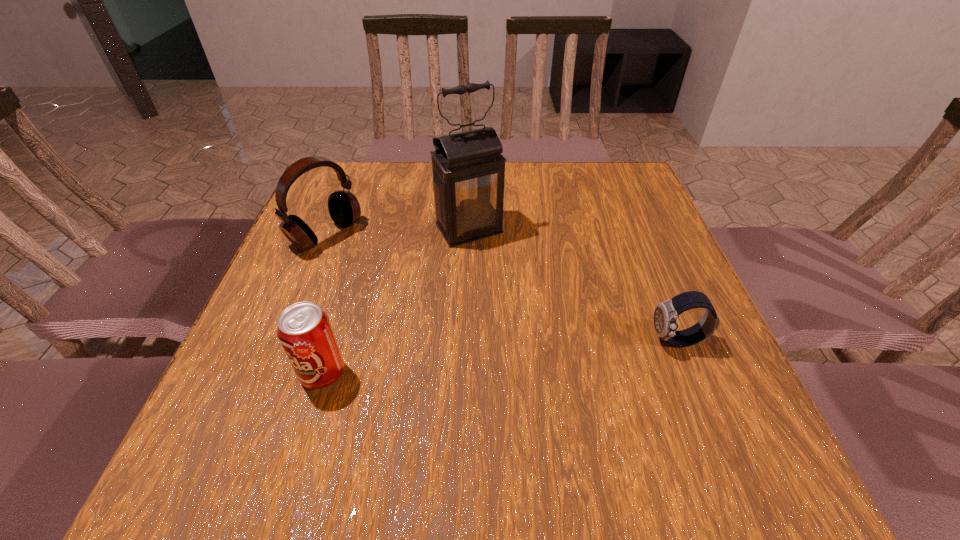
What are the coordinates of `object located in the near left corner section of the desktop` in the screenshot? It's located at click(304, 330).

Image resolution: width=960 pixels, height=540 pixels. What are the coordinates of `vacant region at the far edge of the desktop` in the screenshot? It's located at (552, 208).

Identify the location of free location at the near edge. coord(464,422).

In the image, there is a desktop. In order to click on vacant region at the left edge in this screenshot , I will do `click(312, 225)`.

Locate an element on the screen. free space at the far right corner is located at coordinates (588, 182).

I want to click on empty space between the tallest object and the third shortest object, so click(397, 232).

Where is `free spot between the watch and the headset`? The width and height of the screenshot is (960, 540). free spot between the watch and the headset is located at coordinates (501, 288).

Identify the location of free space that is in between the lantern and the watch. (573, 285).

Locate an element on the screen. free space between the tallest object and the headset is located at coordinates (397, 232).

The width and height of the screenshot is (960, 540). Find the location of `vacant area that lies between the tallest object and the third tallest object`. vacant area that lies between the tallest object and the third tallest object is located at coordinates (396, 301).